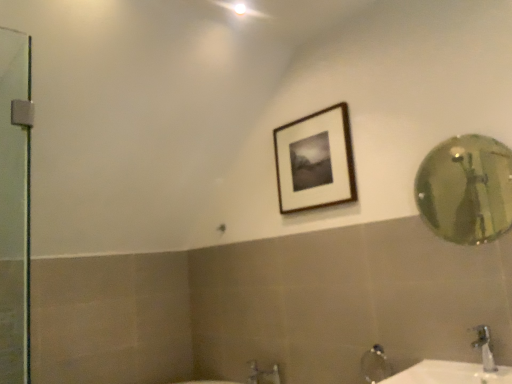
Question: Does gold reflective mirror at right have a lesser width compared to white glossy sink at lower right?

Choices:
 (A) yes
 (B) no

Answer: (A)

Question: From a real-world perspective, is gold reflective mirror at right positioned over white glossy sink at lower right based on gravity?

Choices:
 (A) yes
 (B) no

Answer: (A)

Question: Is white glossy sink at lower right surrounded by gold reflective mirror at right?

Choices:
 (A) no
 (B) yes

Answer: (A)

Question: From the image's perspective, does gold reflective mirror at right appear lower than white glossy sink at lower right?

Choices:
 (A) no
 (B) yes

Answer: (A)

Question: Is gold reflective mirror at right positioned behind white glossy sink at lower right?

Choices:
 (A) no
 (B) yes

Answer: (B)

Question: Considering the positions of silver metallic faucet at lower right and wooden framed picture at upper center in the image, is silver metallic faucet at lower right taller or shorter than wooden framed picture at upper center?

Choices:
 (A) tall
 (B) short

Answer: (B)

Question: In terms of width, does silver metallic faucet at lower right look wider or thinner when compared to wooden framed picture at upper center?

Choices:
 (A) wide
 (B) thin

Answer: (A)

Question: Considering the positions of point click(482, 329) and point click(342, 162), is point click(482, 329) closer or farther from the camera than point click(342, 162)?

Choices:
 (A) farther
 (B) closer

Answer: (B)

Question: Looking at the image, does silver metallic faucet at lower right seem bigger or smaller compared to wooden framed picture at upper center?

Choices:
 (A) small
 (B) big

Answer: (A)

Question: Looking at the image, does gold reflective mirror at right seem bigger or smaller compared to silver metallic faucet at lower right?

Choices:
 (A) big
 (B) small

Answer: (A)

Question: Considering the positions of gold reflective mirror at right and silver metallic faucet at lower right in the image, is gold reflective mirror at right taller or shorter than silver metallic faucet at lower right?

Choices:
 (A) short
 (B) tall

Answer: (B)

Question: Is gold reflective mirror at right wider or thinner than silver metallic faucet at lower right?

Choices:
 (A) wide
 (B) thin

Answer: (B)

Question: Does point (465, 231) appear closer or farther from the camera than point (487, 369)?

Choices:
 (A) closer
 (B) farther

Answer: (B)

Question: Is silver metallic faucet at lower right to the left or to the right of gold reflective mirror at right in the image?

Choices:
 (A) left
 (B) right

Answer: (A)

Question: Relative to gold reflective mirror at right, is silver metallic faucet at lower right in front or behind?

Choices:
 (A) front
 (B) behind

Answer: (A)